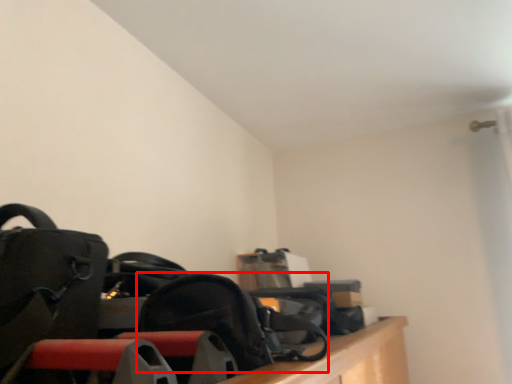
Question: Observing the image, what is the correct spatial positioning of shoulder bag (annotated by the red box) in reference to luggage and bags?

Choices:
 (A) right
 (B) left

Answer: (A)